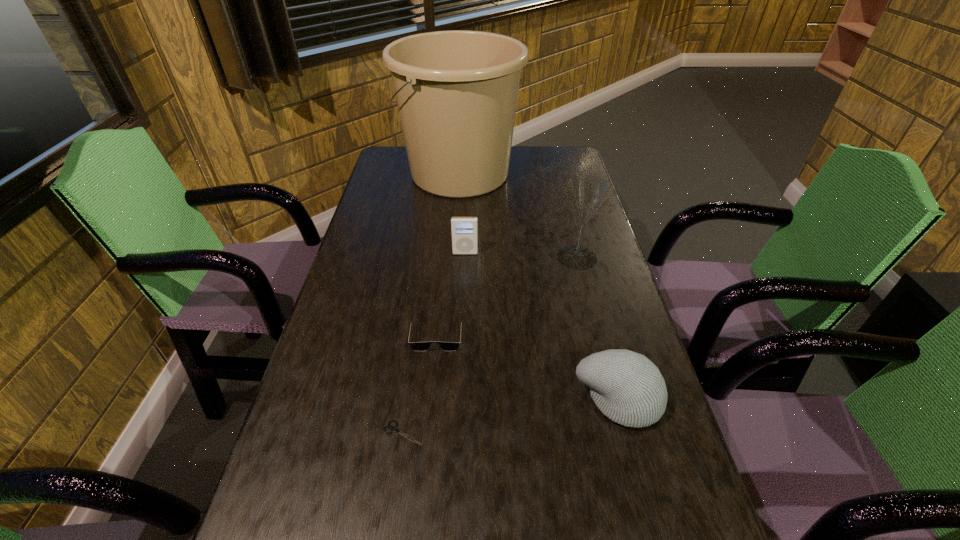
This screenshot has width=960, height=540. Identify the location of vacant area that lies between the tallest object and the beanie. [x=539, y=286].

The height and width of the screenshot is (540, 960). I want to click on object that can be found as the fifth closest to the beanie, so click(456, 91).

You are a GUI agent. You are given a task and a screenshot of the screen. Output one action in this format:
    pyautogui.click(x=<x>, y=<y>)
    Task: Click on the second closest object to the beanie
    The image size is (960, 540).
    Given the screenshot: What is the action you would take?
    pyautogui.click(x=393, y=428)

Locate an element on the screen. The image size is (960, 540). vacant space that satisfies the following two spatial constraints: 1. on the back side of the shortest object; 2. on the left side of the beanie is located at coordinates (408, 399).

The height and width of the screenshot is (540, 960). I want to click on vacant position in the image that satisfies the following two spatial constraints: 1. on the front-facing side of the iPod; 2. on the left side of the beanie, so click(x=460, y=399).

Where is `vacant area in the image that satisfies the following two spatial constraints: 1. on the front-facing side of the flute glass; 2. on the left side of the iPod`? vacant area in the image that satisfies the following two spatial constraints: 1. on the front-facing side of the flute glass; 2. on the left side of the iPod is located at coordinates (465, 258).

Locate an element on the screen. This screenshot has height=540, width=960. vacant space that satisfies the following two spatial constraints: 1. on the front-facing side of the iPod; 2. on the left side of the beanie is located at coordinates (460, 399).